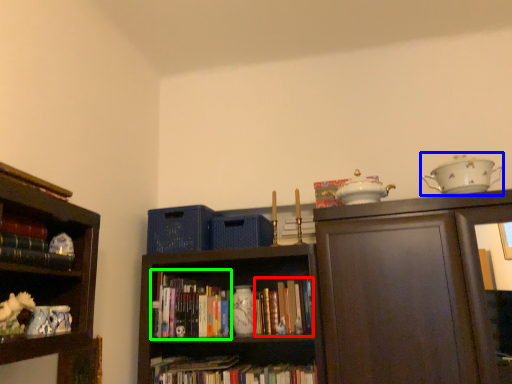
Question: Which object is positioned farthest from book (highlighted by a red box)? Select from tea set (highlighted by a blue box) and book (highlighted by a green box).

Choices:
 (A) tea set
 (B) book

Answer: (A)